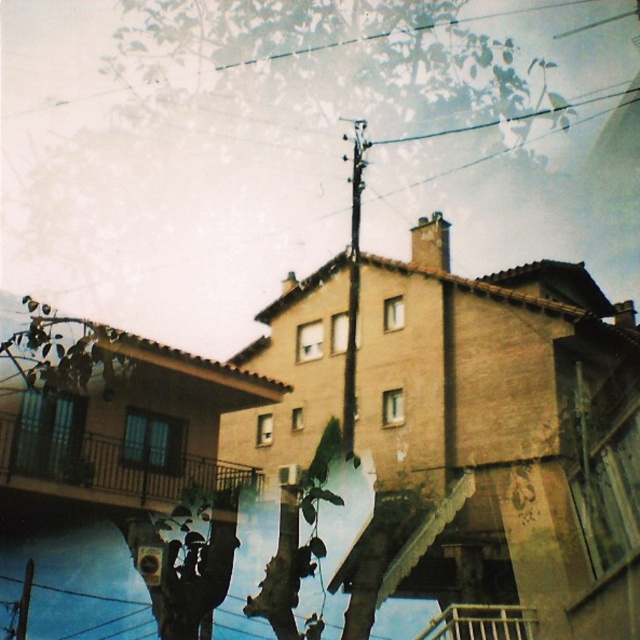
Based on the photo, you are standing in front of the residential building and want to locate the point at coordinates [106,467]. According to the image, where exactly is this point located?

The point at coordinates [106,467] is located on the black metal balcony at lower left.

You are a painter planning to paint this building. You want to highlight the black metal balcony at lower left and the wooden at lower center. Which object should you paint with a darker shade to make it stand out more against the foliage overlay?

The black metal balcony at lower left is smaller than wooden at lower center. Since it is smaller, painting it with a darker shade would help it stand out more against the foliage overlay.

You are standing in front of a residential building with a balcony on the left side. You see two points marked on the image. Which point is closer to you, point (228,509) or point (124,371)?

Point (124,371) is closer to you because it is less further to the camera than point (228,509).